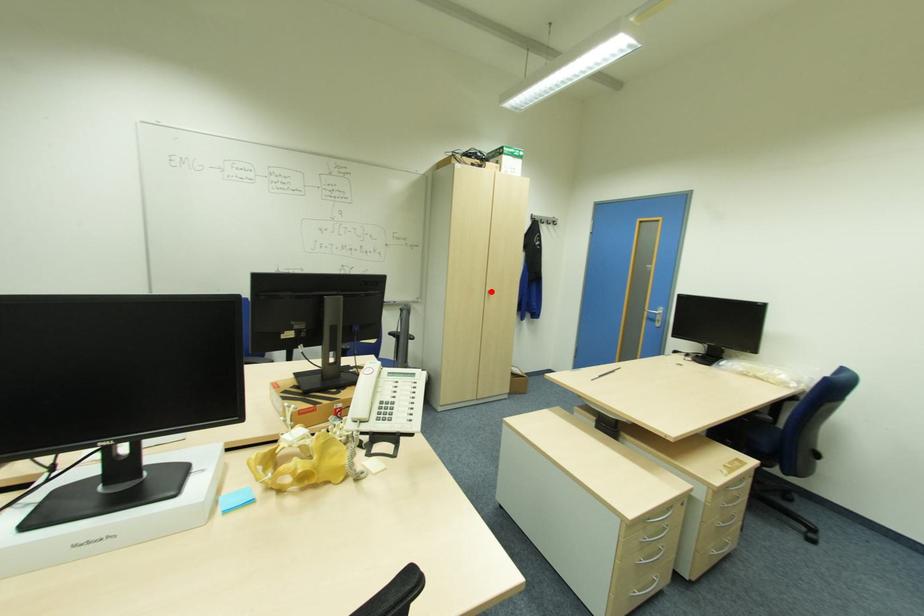
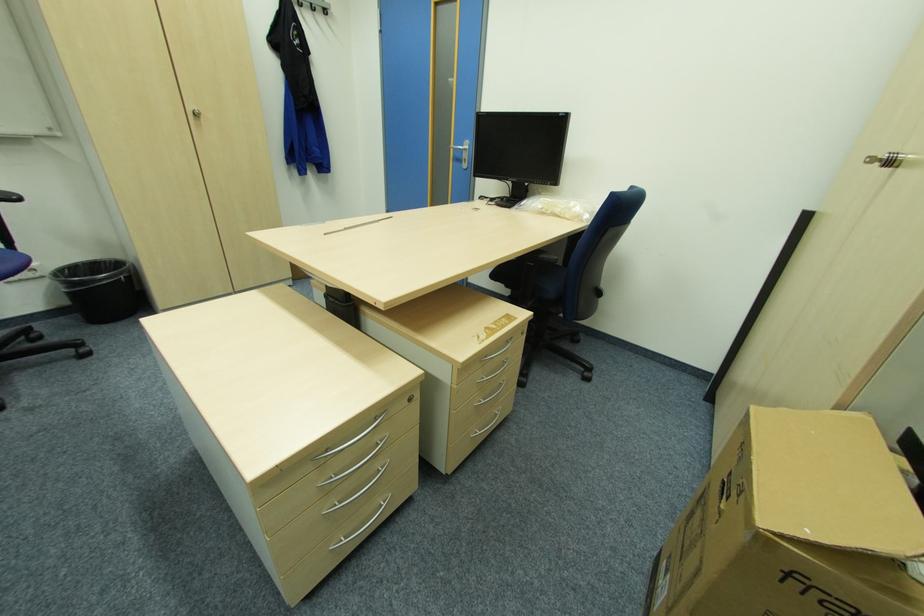
Find the pixel in the second image that matches the highlighted location in the first image.

(198, 114)